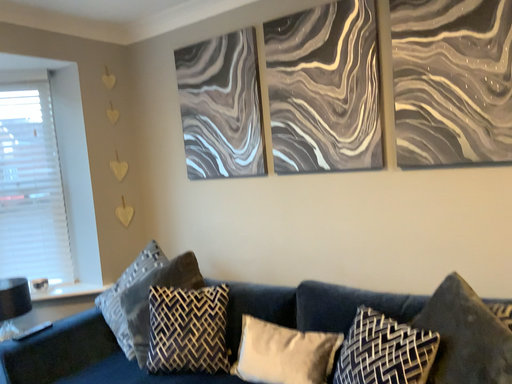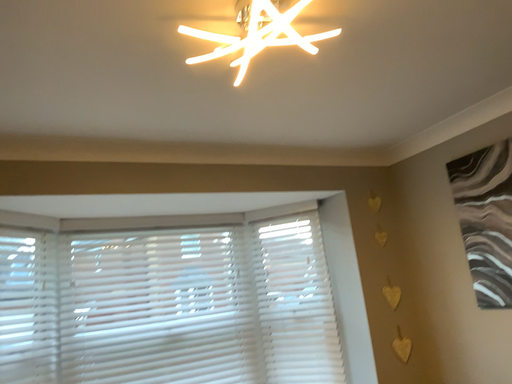
Question: Which way did the camera rotate in the video?

Choices:
 (A) rotated left
 (B) rotated right

Answer: (A)